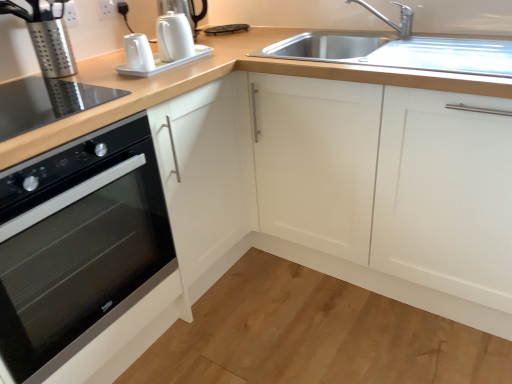
How much space does white glossy coffee machine at upper center, the 2th coffee machine positioned from the left, occupy horizontally?

The width of white glossy coffee machine at upper center, the 2th coffee machine positioned from the left, is 13.15 centimeters.

Describe the element at coordinates (165, 43) in the screenshot. I see `white glossy coffee machine at upper center, the 2th coffee machine positioned from the left` at that location.

What do you see at coordinates (346, 188) in the screenshot?
I see `white matte cabinet at upper right` at bounding box center [346, 188].

Locate an element on the screen. white matte cabinet at upper right is located at coordinates (346, 188).

Find the location of a particular element. white glossy kettle at upper center, which appears as the 2th appliance when viewed from the top is located at coordinates (165, 63).

What do you see at coordinates (314, 335) in the screenshot? Image resolution: width=512 pixels, height=384 pixels. I see `smooth wood floor at lower center` at bounding box center [314, 335].

Describe the element at coordinates (46, 36) in the screenshot. I see `silver perforated coffee machine at left, marked as the second coffee machine in a right-to-left arrangement` at that location.

Identify the location of white glossy kettle at upper center, the second appliance when ordered from bottom to top. (138, 53).

Is white glossy electric kettle at upper center, which is counted as the first appliance, starting from the top, a part of white glossy kettle at upper center, the second appliance when ordered from bottom to top?

No, white glossy kettle at upper center, the second appliance when ordered from bottom to top, does not contain white glossy electric kettle at upper center, which is counted as the first appliance, starting from the top.

How different are the orientations of white glossy kettle at upper center, the 3th appliance in the top-to-bottom sequence, and white glossy electric kettle at upper center, which is counted as the 4th appliance, starting from the bottom, in degrees?

They differ by 0.000322 degrees in their facing directions.

Is point (150, 54) closer to viewer compared to point (190, 19)?

Yes, it is in front of point (190, 19).

Are white matte cabinet at upper right and white glossy electric kettle at upper center, which is counted as the first appliance, starting from the top, far apart?

No, there isn't a large distance between white matte cabinet at upper right and white glossy electric kettle at upper center, which is counted as the first appliance, starting from the top.

Find the location of a particular element. cabinetry below the white glossy electric kettle at upper center, which is counted as the 4th appliance, starting from the bottom (from a real-world perspective) is located at coordinates pos(346,188).

From a real-world perspective, is white matte cabinet at upper right on top of white glossy electric kettle at upper center, which is counted as the 4th appliance, starting from the bottom?

No.

Which is in front, white matte cabinet at upper right or white glossy electric kettle at upper center, which is counted as the first appliance, starting from the top?

white matte cabinet at upper right is more forward.

Which point is more distant from viewer, (152, 70) or (39, 164)?

The point (152, 70) is behind.

Is white glossy kettle at upper center, the second appliance when ordered from bottom to top, spatially inside black glass oven at left, or outside of it?

white glossy kettle at upper center, the second appliance when ordered from bottom to top, lies outside black glass oven at left.

From the image's perspective, is white glossy kettle at upper center, the 3th appliance in the top-to-bottom sequence, beneath black glass oven at left?

Incorrect, from the image's perspective, white glossy kettle at upper center, the 3th appliance in the top-to-bottom sequence, is higher than black glass oven at left.

What's the angular difference between white glossy kettle at upper center, the 3th appliance in the top-to-bottom sequence, and black glass oven at left's facing directions?

The angle between the facing direction of white glossy kettle at upper center, the 3th appliance in the top-to-bottom sequence, and the facing direction of black glass oven at left is 4.34 degrees.

Considering the sizes of objects white glossy electric kettle at upper center, which is counted as the first appliance, starting from the top, and black glass cooktop at lower left, the 4th appliance from the top, in the image provided, who is wider, white glossy electric kettle at upper center, which is counted as the first appliance, starting from the top, or black glass cooktop at lower left, the 4th appliance from the top,?

black glass cooktop at lower left, the 4th appliance from the top.

Can we say white glossy electric kettle at upper center, which is counted as the 4th appliance, starting from the bottom, lies outside black glass cooktop at lower left, the 4th appliance from the top?

white glossy electric kettle at upper center, which is counted as the 4th appliance, starting from the bottom, lies outside black glass cooktop at lower left, the 4th appliance from the top,'s area.

Is white glossy electric kettle at upper center, which is counted as the 4th appliance, starting from the bottom, in front of or behind black glass cooktop at lower left, the first appliance in the bottom-to-top sequence, in the image?

Visually, white glossy electric kettle at upper center, which is counted as the 4th appliance, starting from the bottom, is located behind black glass cooktop at lower left, the first appliance in the bottom-to-top sequence.

The image size is (512, 384). In order to click on cabinetry above the smooth wood floor at lower center (from the image's perspective) in this screenshot , I will do point(346,188).

Is point (262, 371) in front of point (267, 131)?

Yes, it is.

From a real-world perspective, is smooth wood floor at lower center above or below white matte cabinet at upper right?

From a real-world perspective, smooth wood floor at lower center is physically below white matte cabinet at upper right.

Looking at this image, can you confirm if smooth wood floor at lower center is taller than white matte cabinet at upper right?

No.

From the image's perspective, relative to black glass cooktop at lower left, the first appliance in the bottom-to-top sequence, is silver metallic faucet at upper right above or below?

silver metallic faucet at upper right is situated higher than black glass cooktop at lower left, the first appliance in the bottom-to-top sequence, in the image.

Considering the relative positions of silver metallic faucet at upper right and black glass cooktop at lower left, the first appliance in the bottom-to-top sequence, in the image provided, is silver metallic faucet at upper right to the left of black glass cooktop at lower left, the first appliance in the bottom-to-top sequence, from the viewer's perspective?

No, silver metallic faucet at upper right is not to the left of black glass cooktop at lower left, the first appliance in the bottom-to-top sequence.

Considering the relative positions of silver metallic faucet at upper right and black glass cooktop at lower left, the first appliance in the bottom-to-top sequence, in the image provided, is silver metallic faucet at upper right behind black glass cooktop at lower left, the first appliance in the bottom-to-top sequence,?

Yes, silver metallic faucet at upper right is further from the camera.

How far apart are silver perforated coffee machine at left, placed as the 1th coffee machine when sorted from left to right, and white glossy coffee machine at upper center, the 1th coffee machine from the right?

13.88 inches.

Based on the photo, can you see silver perforated coffee machine at left, placed as the 1th coffee machine when sorted from left to right, touching white glossy coffee machine at upper center, the 1th coffee machine from the right?

No, silver perforated coffee machine at left, placed as the 1th coffee machine when sorted from left to right, is not in contact with white glossy coffee machine at upper center, the 1th coffee machine from the right.

In the image, there is a silver perforated coffee machine at left, placed as the 1th coffee machine when sorted from left to right. Where is `coffee machine above it (from the image's perspective)`? The width and height of the screenshot is (512, 384). coffee machine above it (from the image's perspective) is located at coordinates [165, 43].

Based on the photo, would you say silver perforated coffee machine at left, marked as the second coffee machine in a right-to-left arrangement, contains white glossy coffee machine at upper center, the 1th coffee machine from the right?

No, white glossy coffee machine at upper center, the 1th coffee machine from the right, is not inside silver perforated coffee machine at left, marked as the second coffee machine in a right-to-left arrangement.

From the white glossy electric kettle at upper center, which is counted as the first appliance, starting from the top, count 2nd appliances forward and point to it. Please provide its 2D coordinates.

[(138, 53)]

Where is `appliance that is the 2nd object to the left of the white matte cabinet at upper right, starting at the anchor`? appliance that is the 2nd object to the left of the white matte cabinet at upper right, starting at the anchor is located at coordinates (184, 11).

Looking at the image, which one is located further to white glossy coffee machine at upper center, the 2th coffee machine positioned from the left, silver metallic faucet at upper right or black glass oven at left?

Among the two, silver metallic faucet at upper right is located further to white glossy coffee machine at upper center, the 2th coffee machine positioned from the left.

Estimate the real-world distances between objects in this image. Which object is closer to white glossy kettle at upper center, the third appliance when ordered from bottom to top, white glossy kettle at upper center, the second appliance when ordered from bottom to top, or black glass oven at left?

Based on the image, white glossy kettle at upper center, the second appliance when ordered from bottom to top, appears to be nearer to white glossy kettle at upper center, the third appliance when ordered from bottom to top.

When comparing their distances from black glass cooktop at lower left, the first appliance in the bottom-to-top sequence, does white matte cabinet at upper right or white glossy coffee machine at upper center, the 1th coffee machine from the right, seem closer?

white glossy coffee machine at upper center, the 1th coffee machine from the right, is closer to black glass cooktop at lower left, the first appliance in the bottom-to-top sequence.

Considering their positions, is white glossy coffee machine at upper center, the 2th coffee machine positioned from the left, positioned closer to white glossy electric kettle at upper center, which is counted as the first appliance, starting from the top, than smooth wood floor at lower center?

white glossy coffee machine at upper center, the 2th coffee machine positioned from the left, lies closer to white glossy electric kettle at upper center, which is counted as the first appliance, starting from the top, than the other object.

Estimate the real-world distances between objects in this image. Which object is further from silver perforated coffee machine at left, marked as the second coffee machine in a right-to-left arrangement, white matte cabinet at upper right or white glossy kettle at upper center, which appears as the 2th appliance when viewed from the top?

The object further to silver perforated coffee machine at left, marked as the second coffee machine in a right-to-left arrangement, is white matte cabinet at upper right.

From the picture: Considering their positions, is silver metallic faucet at upper right positioned closer to white matte cabinet at upper right than smooth wood floor at lower center?

smooth wood floor at lower center lies closer to white matte cabinet at upper right than the other object.

Estimate the real-world distances between objects in this image. Which object is further from silver metallic faucet at upper right, white glossy coffee machine at upper center, the 1th coffee machine from the right, or black glass oven at left?

black glass oven at left is further to silver metallic faucet at upper right.

When comparing their distances from silver perforated coffee machine at left, marked as the second coffee machine in a right-to-left arrangement, does white matte cabinet at upper right or black glass cooktop at lower left, the 4th appliance from the top, seem further?

white matte cabinet at upper right is further to silver perforated coffee machine at left, marked as the second coffee machine in a right-to-left arrangement.

Where is `home appliance between silver perforated coffee machine at left, placed as the 1th coffee machine when sorted from left to right, and smooth wood floor at lower center in the up-down direction`? The width and height of the screenshot is (512, 384). home appliance between silver perforated coffee machine at left, placed as the 1th coffee machine when sorted from left to right, and smooth wood floor at lower center in the up-down direction is located at coordinates (78, 244).

The image size is (512, 384). I want to click on home appliance between black glass cooktop at lower left, the 4th appliance from the top, and smooth wood floor at lower center vertically, so click(78, 244).

At what (x,y) coordinates should I click in order to perform the action: click on appliance between black glass cooktop at lower left, the 4th appliance from the top, and white glossy kettle at upper center, which appears as the 2th appliance when viewed from the top, along the z-axis. Please return your answer as a coordinate pair (x, y). Image resolution: width=512 pixels, height=384 pixels. Looking at the image, I should click on [138, 53].

I want to click on cabinetry between white glossy kettle at upper center, the second appliance when ordered from bottom to top, and smooth wood floor at lower center, in the vertical direction, so click(x=346, y=188).